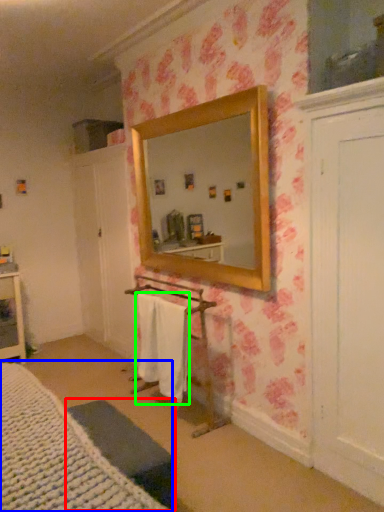
Question: Which object is the farthest from furniture (highlighted by a red box)? Choose among these: bed (highlighted by a blue box) or bath towel (highlighted by a green box).

Choices:
 (A) bed
 (B) bath towel

Answer: (B)